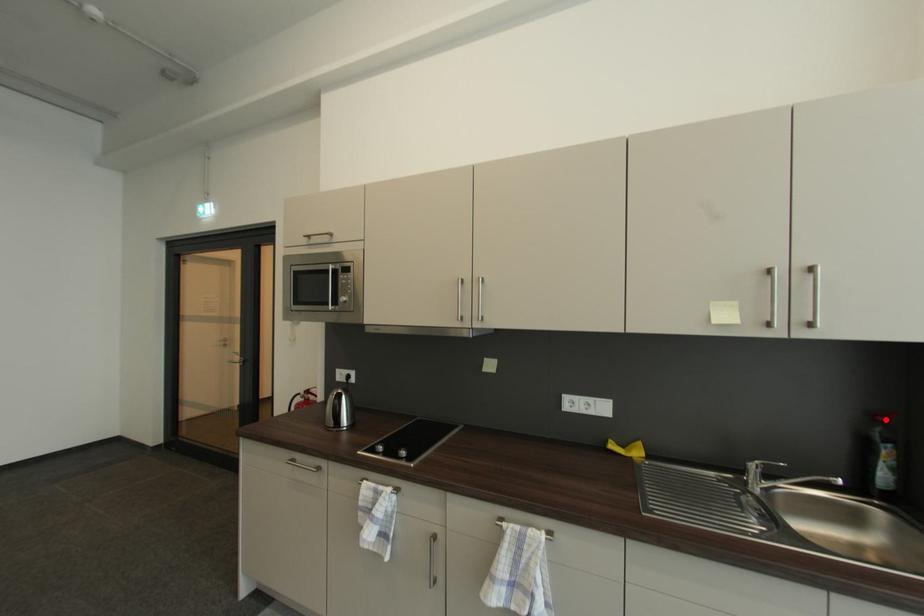
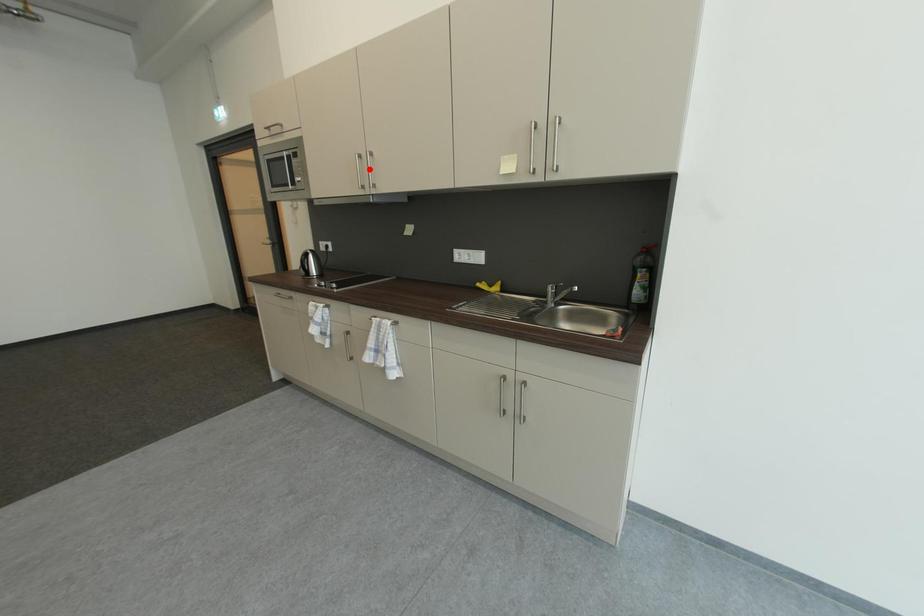
I am providing you with two images of the same scene from different viewpoints. A red point is marked on the first image and another point is marked on the second image. Does the point marked in image1 correspond to the same location as the one in image2?

No